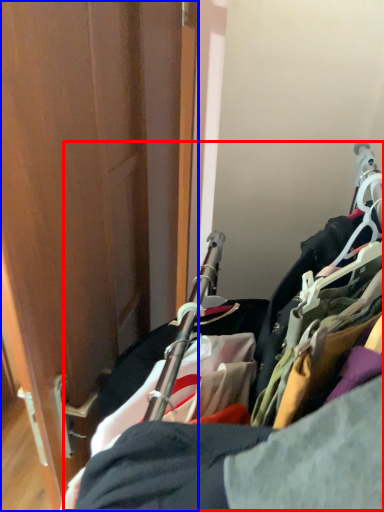
Question: Which of the following is the farthest to the observer, closet (highlighted by a red box) or door (highlighted by a blue box)?

Choices:
 (A) closet
 (B) door

Answer: (B)